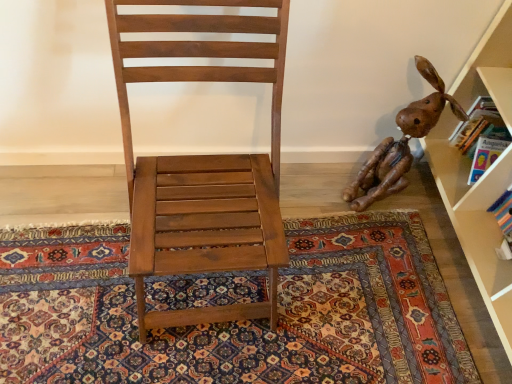
Question: Do you think carpeted floor at center is within matte wood chair at center, or outside of it?

Choices:
 (A) inside
 (B) outside

Answer: (B)

Question: From their relative heights in the image, would you say carpeted floor at center is taller or shorter than matte wood chair at center?

Choices:
 (A) short
 (B) tall

Answer: (A)

Question: Which object is the closest to the brown leather dog at right?

Choices:
 (A) matte wood chair at center
 (B) carpeted floor at center

Answer: (B)

Question: Which of these objects is positioned closest to the brown leather dog at right?

Choices:
 (A) matte wood chair at center
 (B) carpeted floor at center

Answer: (B)